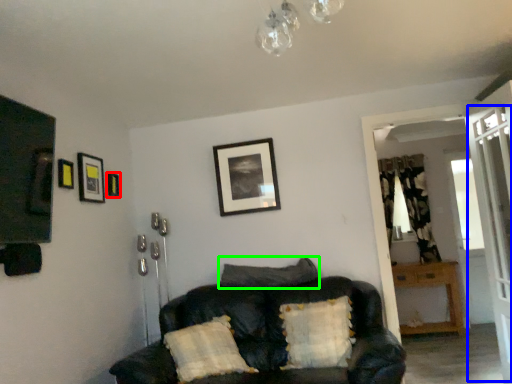
Question: Based on their relative distances, which object is farther from picture frame (highlighted by a red box)? Choose from screen door (highlighted by a blue box) and pillow (highlighted by a green box).

Choices:
 (A) screen door
 (B) pillow

Answer: (A)